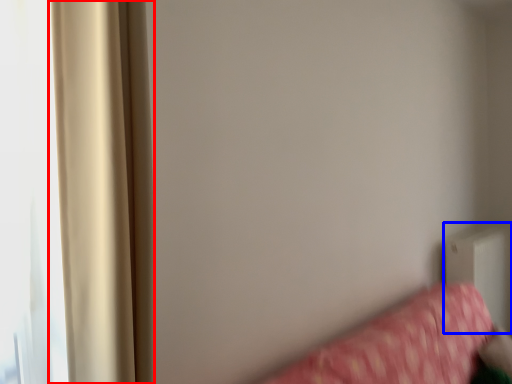
Question: Which object is closer to the camera taking this photo, curtain (highlighted by a red box) or radiator (highlighted by a blue box)?

Choices:
 (A) curtain
 (B) radiator

Answer: (A)